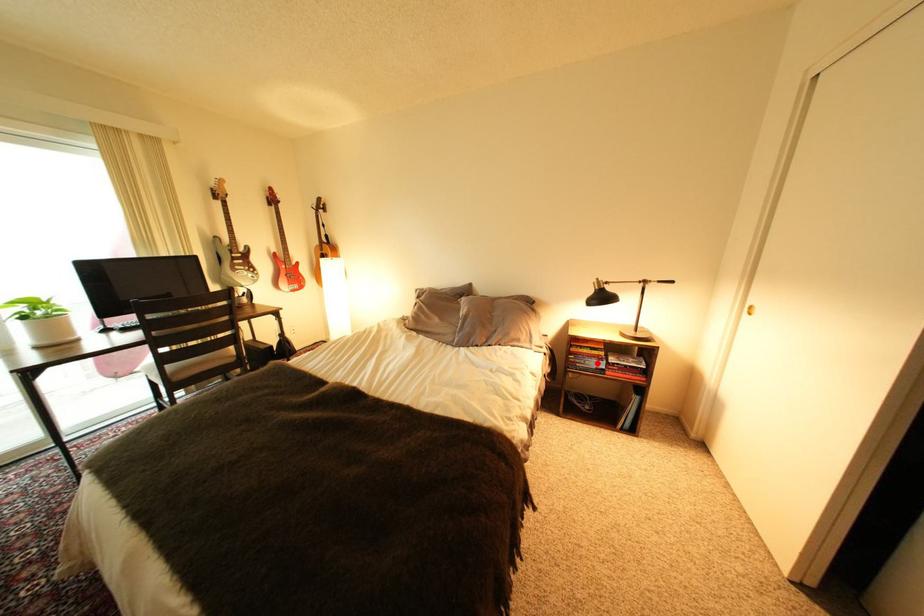
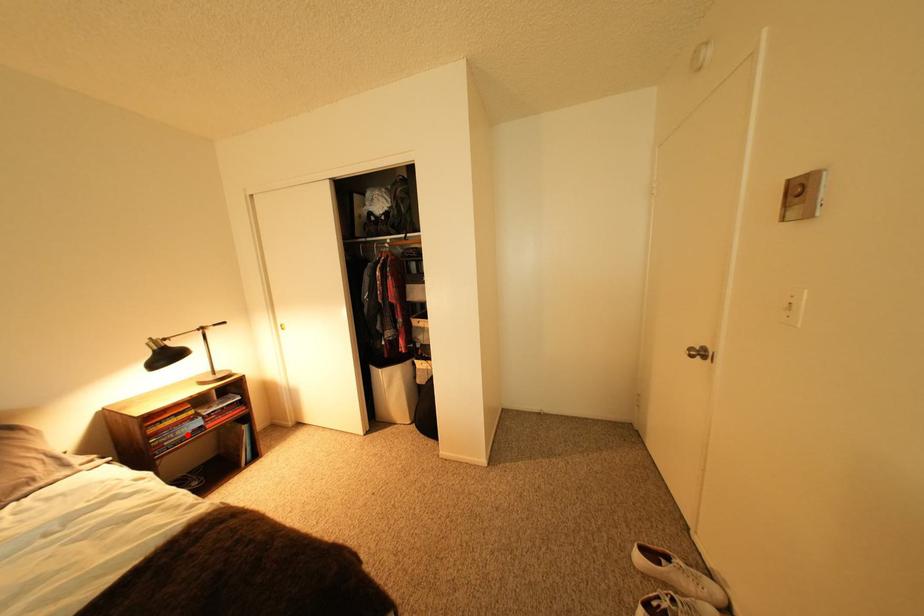
I am providing you with two images of the same scene from different viewpoints. A red point is marked on the first image and another point is marked on the second image. Does the point marked in image1 correspond to the same location as the one in image2?

Yes